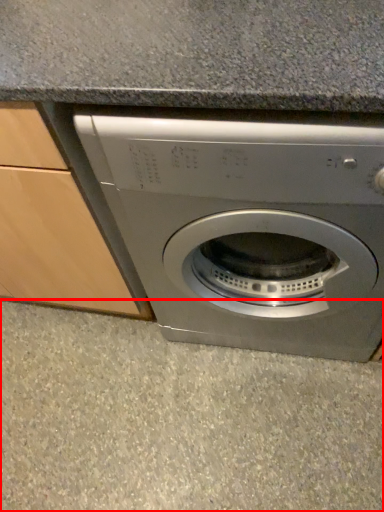
Question: In this image, where is concrete (annotated by the red box) located relative to washing machine?

Choices:
 (A) right
 (B) left

Answer: (B)